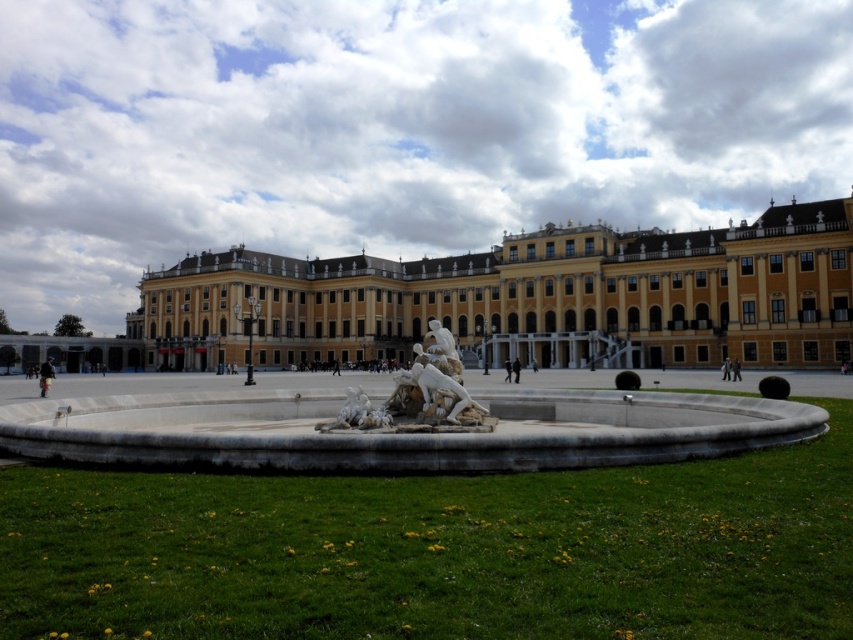
Is yellow stone palace at center thinner than white marble sculpture at center?

No.

Does yellow stone palace at center have a greater height compared to white marble sculpture at center?

Correct, yellow stone palace at center is much taller as white marble sculpture at center.

Describe the element at coordinates (526, 298) in the screenshot. I see `yellow stone palace at center` at that location.

I want to click on yellow stone palace at center, so click(x=526, y=298).

What are the coordinates of `yellow stone palace at center` in the screenshot? It's located at (526, 298).

This screenshot has width=853, height=640. What do you see at coordinates (526, 298) in the screenshot?
I see `yellow stone palace at center` at bounding box center [526, 298].

Which is in front, point (160, 326) or point (554, 392)?

Positioned in front is point (554, 392).

The width and height of the screenshot is (853, 640). I want to click on yellow stone palace at center, so click(x=526, y=298).

Does white marble fountain at center appear on the left side of white marble sculpture at center?

Correct, you'll find white marble fountain at center to the left of white marble sculpture at center.

Is point (74, 400) positioned behind point (409, 380)?

No, (74, 400) is closer to viewer.

Where is `white marble fountain at center`? The image size is (853, 640). white marble fountain at center is located at coordinates (399, 429).